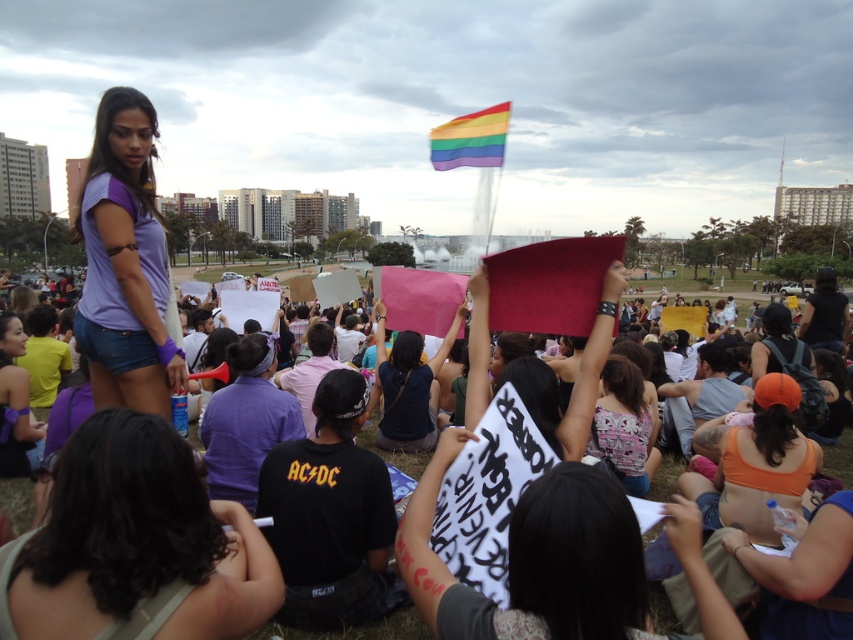
Does matte purple shirt at center have a smaller size compared to pink floral tank top at center?

Actually, matte purple shirt at center might be larger than pink floral tank top at center.

Is matte purple shirt at center below pink floral tank top at center?

Yes.

Does point (120, 419) come in front of point (596, 416)?

Yes, it is in front of point (596, 416).

Find the location of a particular element. The height and width of the screenshot is (640, 853). matte purple shirt at center is located at coordinates (138, 540).

Is the position of matte purple shirt at center less distant than that of white paper signs at center?

Yes, it is.

Between matte purple shirt at center and white paper signs at center, which one has less height?

white paper signs at center is shorter.

Who is more distant from viewer, (138,461) or (664,499)?

Point (664,499)

At what (x,y) coordinates should I click in order to perform the action: click on matte purple shirt at center. Please return your answer as a coordinate pair (x, y). Image resolution: width=853 pixels, height=640 pixels. Looking at the image, I should click on (138, 540).

Who is lower down, purple matte shirt at upper left or pink floral tank top at center?

Positioned lower is pink floral tank top at center.

Is point (155, 230) positioned in front of point (619, 456)?

Yes, point (155, 230) is in front of point (619, 456).

This screenshot has height=640, width=853. I want to click on purple matte shirt at upper left, so [x=125, y=262].